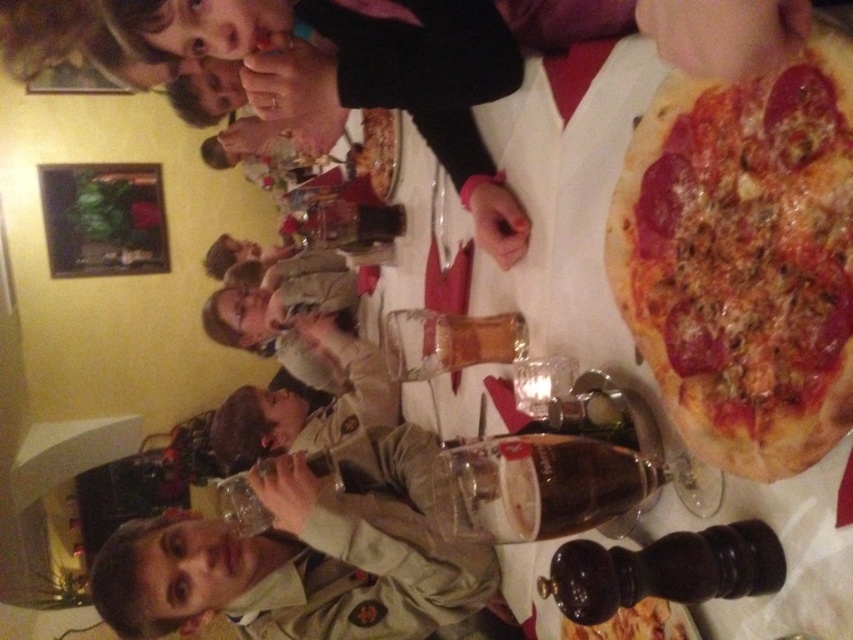
Between smooth black shirt at upper center and translucent glass bottle at center, which one has less height?

translucent glass bottle at center is shorter.

Does smooth black shirt at upper center appear under translucent glass bottle at center?

No.

Does point (509, 196) come in front of point (503, 342)?

Yes, it is in front of point (503, 342).

The height and width of the screenshot is (640, 853). In order to click on smooth black shirt at upper center in this screenshot , I will do `click(358, 76)`.

Is tan uniform at center below translucent glass beer at center?

Indeed, tan uniform at center is positioned under translucent glass beer at center.

Describe the element at coordinates (305, 561) in the screenshot. The height and width of the screenshot is (640, 853). I see `tan uniform at center` at that location.

Who is more forward, (97, 582) or (647, 486)?

Point (647, 486) is more forward.

Identify the location of tan uniform at center. (305, 561).

Can you confirm if smooth black shirt at upper center is shorter than translucent glass beer at center?

No, smooth black shirt at upper center is not shorter than translucent glass beer at center.

The width and height of the screenshot is (853, 640). What do you see at coordinates (358, 76) in the screenshot? I see `smooth black shirt at upper center` at bounding box center [358, 76].

The height and width of the screenshot is (640, 853). I want to click on smooth black shirt at upper center, so click(x=358, y=76).